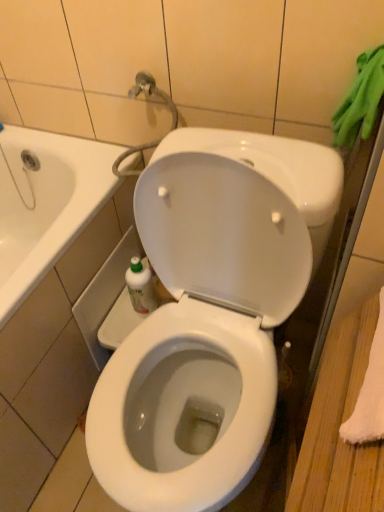
What is the approximate width of green rubber gloves at upper right?

green rubber gloves at upper right is 4.81 inches in width.

The image size is (384, 512). In order to click on white glossy toilet at center in this screenshot , I will do `click(211, 312)`.

Locate an element on the screen. This screenshot has width=384, height=512. green rubber gloves at upper right is located at coordinates (360, 100).

Would you say green rubber gloves at upper right is to the left or to the right of white glossy toilet at center in the picture?

In the image, green rubber gloves at upper right appears on the right side of white glossy toilet at center.

Between green rubber gloves at upper right and white glossy toilet at center, which one has less height?

Standing shorter between the two is green rubber gloves at upper right.

Is point (366, 126) closer to viewer compared to point (180, 497)?

No, it is behind (180, 497).

Considering the points (143, 270) and (255, 457), which point is behind, point (143, 270) or point (255, 457)?

The point (143, 270) is farther from the camera.

Between translucent plastic bottle at lower left and white glossy toilet at center, which one is positioned behind?

translucent plastic bottle at lower left.

Is translucent plastic bottle at lower left surrounding white glossy toilet at center?

No, white glossy toilet at center is not a part of translucent plastic bottle at lower left.

Is green rubber gloves at upper right located within white glossy toilet at center?

No, green rubber gloves at upper right is located outside of white glossy toilet at center.

From the image's perspective, which one is positioned higher, white glossy toilet at center or green rubber gloves at upper right?

green rubber gloves at upper right appears higher in the image.

How different are the orientations of white glossy toilet at center and green rubber gloves at upper right in degrees?

0.00215 degrees separate the facing orientations of white glossy toilet at center and green rubber gloves at upper right.

At what (x,y) coordinates should I click in order to perform the action: click on toilet in front of the translucent plastic bottle at lower left. Please return your answer as a coordinate pair (x, y). Looking at the image, I should click on (211, 312).

Would you say white glossy toilet at center is inside or outside translucent plastic bottle at lower left?

white glossy toilet at center cannot be found inside translucent plastic bottle at lower left.

Based on their sizes in the image, would you say translucent plastic bottle at lower left is bigger or smaller than green rubber gloves at upper right?

translucent plastic bottle at lower left is smaller than green rubber gloves at upper right.

Does translucent plastic bottle at lower left have a greater height compared to green rubber gloves at upper right?

No.

Which point is more forward, [144,293] or [383,65]?

The point [383,65] is in front.

From the image's perspective, which one is positioned lower, translucent plastic bottle at lower left or green rubber gloves at upper right?

translucent plastic bottle at lower left, from the image's perspective.

Is green rubber gloves at upper right in front of or behind translucent plastic bottle at lower left in the image?

Clearly, green rubber gloves at upper right is in front of translucent plastic bottle at lower left.

In terms of width, does green rubber gloves at upper right look wider or thinner when compared to translucent plastic bottle at lower left?

Clearly, green rubber gloves at upper right has more width compared to translucent plastic bottle at lower left.

The image size is (384, 512). I want to click on bottle that is below the green rubber gloves at upper right (from the image's perspective), so click(141, 287).

Considering the positions of objects green rubber gloves at upper right and translucent plastic bottle at lower left in the image provided, who is more to the left, green rubber gloves at upper right or translucent plastic bottle at lower left?

translucent plastic bottle at lower left.

Locate an element on the screen. bath towel above the white glossy toilet at center (from the image's perspective) is located at coordinates (360, 100).

In order to click on toilet above the translucent plastic bottle at lower left (from a real-world perspective) in this screenshot , I will do `click(211, 312)`.

From the image, which object appears to be farther from translucent plastic bottle at lower left, white glossy toilet at center or green rubber gloves at upper right?

green rubber gloves at upper right lies further to translucent plastic bottle at lower left than the other object.

In the scene shown: From the image, which object appears to be farther from white glossy toilet at center, translucent plastic bottle at lower left or green rubber gloves at upper right?

Among the two, green rubber gloves at upper right is located further to white glossy toilet at center.

Estimate the real-world distances between objects in this image. Which object is further from green rubber gloves at upper right, white glossy toilet at center or translucent plastic bottle at lower left?

Among the two, translucent plastic bottle at lower left is located further to green rubber gloves at upper right.

Estimate the real-world distances between objects in this image. Which object is closer to white glossy toilet at center, green rubber gloves at upper right or translucent plastic bottle at lower left?

translucent plastic bottle at lower left lies closer to white glossy toilet at center than the other object.

Based on their spatial positions, is translucent plastic bottle at lower left or white glossy toilet at center closer to green rubber gloves at upper right?

white glossy toilet at center is closer to green rubber gloves at upper right.

Considering their positions, is green rubber gloves at upper right positioned closer to translucent plastic bottle at lower left than white glossy toilet at center?

white glossy toilet at center is closer to translucent plastic bottle at lower left.

Locate an element on the screen. bath towel between white glossy toilet at center and translucent plastic bottle at lower left from front to back is located at coordinates (360, 100).